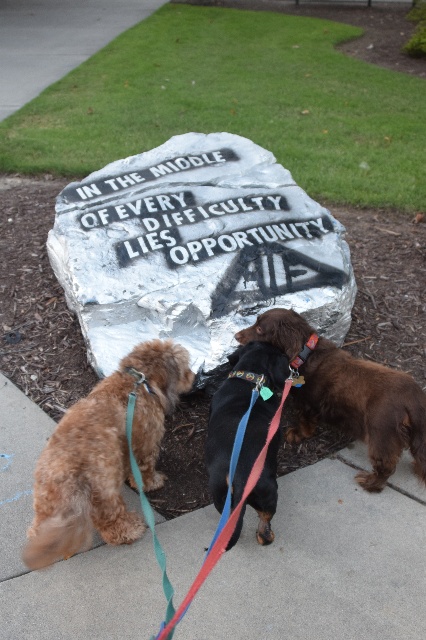
Question: Does golden brown fur at lower left have a greater width compared to brown furry dog at center?

Choices:
 (A) yes
 (B) no

Answer: (B)

Question: Which point is farther to the camera?

Choices:
 (A) (278, 593)
 (B) (71, 17)
 (C) (215, 429)
 (D) (124, 387)

Answer: (B)

Question: Observing the image, what is the correct spatial positioning of brown furry dog at center in reference to multicolored fabric leash at center?

Choices:
 (A) right
 (B) left

Answer: (A)

Question: Which of the following is the farthest from the observer?

Choices:
 (A) (71, 515)
 (B) (198, 163)

Answer: (B)

Question: Which of the following is the farthest from the observer?

Choices:
 (A) gray concrete pavement at upper left
 (B) brown furry dog at center

Answer: (A)

Question: Is silver metallic stone at center wider than golden brown fur at lower left?

Choices:
 (A) no
 (B) yes

Answer: (B)